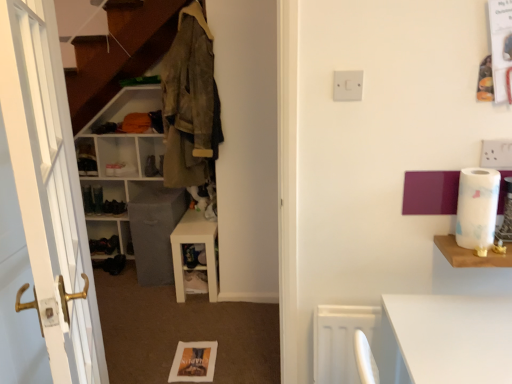
Question: Is wooden shelf at right, acting as the third shelf starting from the back, in front of or behind white matte shelf at center, the 3th shelf from the front, in the image?

Choices:
 (A) behind
 (B) front

Answer: (B)

Question: From the image's perspective, is wooden shelf at right, which appears as the 1th shelf when viewed from the right, located above or below white matte shelf at center, the 3th shelf from the front?

Choices:
 (A) below
 (B) above

Answer: (A)

Question: Which of these objects is positioned farthest from the black leather shoe at lower left?

Choices:
 (A) white glossy shelf at center, which is the second shelf in right-to-left order
 (B) white matte shelf at center, which ranks as the first shelf in back-to-front order
 (C) white wooden door at left
 (D) camouflage fabric jacket at upper left
 (E) matte white cabinet at left

Answer: (C)

Question: Estimate the real-world distances between objects in this image. Which object is farther from the white glossy dresser at center?

Choices:
 (A) black leather shoe at lower left
 (B) white marble toilet paper at right
 (C) matte white cabinet at left
 (D) white wooden door at left
 (E) white glossy shelf at center, which is the second shelf in right-to-left order

Answer: (C)